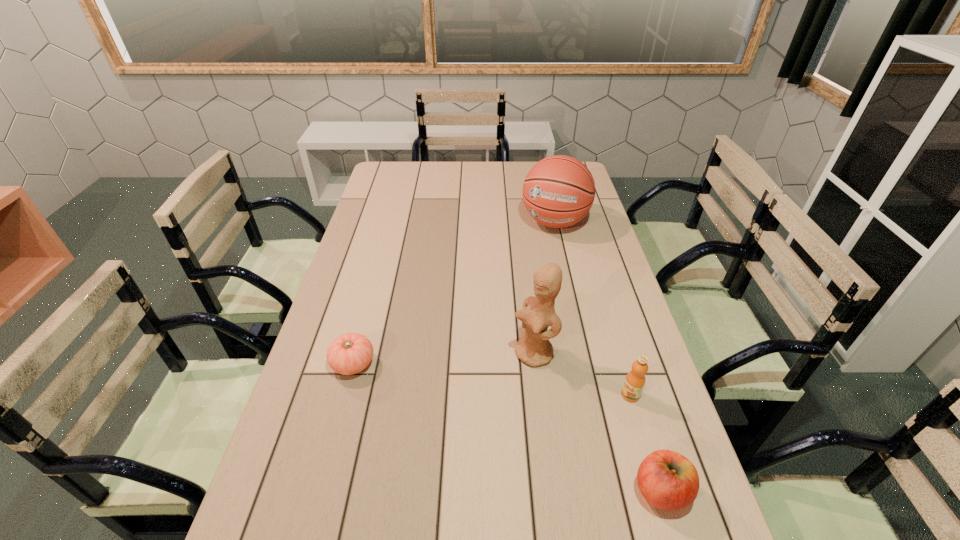
Identify which object is the third nearest to the basketball. Please provide its 2D coordinates. Your answer should be formatted as a tuple, i.e. [(x, y)], where the tuple contains the x and y coordinates of a point satisfying the conditions above.

[(350, 353)]

At what (x,y) coordinates should I click in order to perform the action: click on free space that satisfies the following two spatial constraints: 1. on the back side of the farthest object; 2. on the left side of the figurine. Please return your answer as a coordinate pair (x, y). Looking at the image, I should click on (517, 222).

Where is `vacant point that satisfies the following two spatial constraints: 1. on the front side of the nearest object; 2. on the right side of the leftmost object`? This screenshot has width=960, height=540. vacant point that satisfies the following two spatial constraints: 1. on the front side of the nearest object; 2. on the right side of the leftmost object is located at coordinates (319, 491).

Image resolution: width=960 pixels, height=540 pixels. What are the coordinates of `vacant region that satisfies the following two spatial constraints: 1. on the front side of the second shortest object; 2. on the right side of the basketball` in the screenshot? It's located at [615, 491].